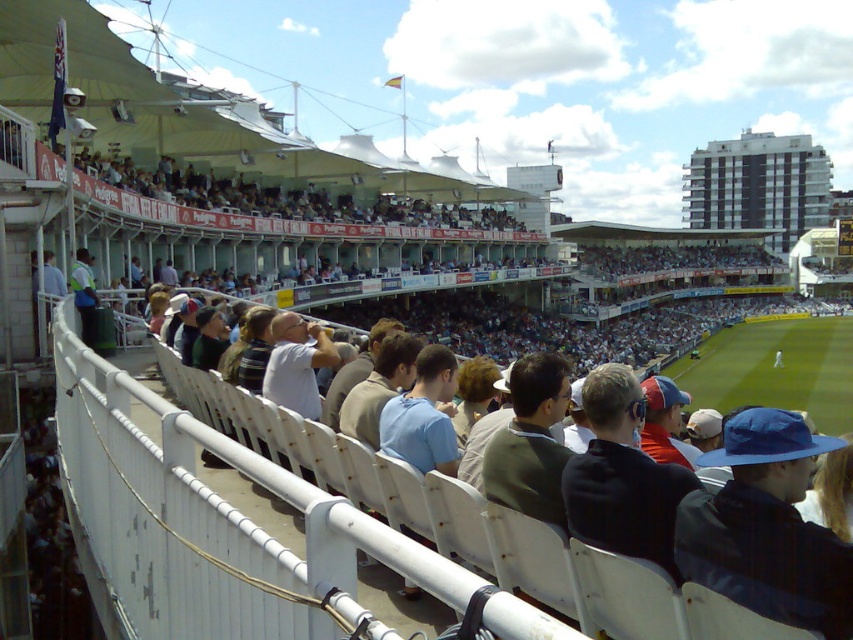
Question: Can you confirm if dark blue cap at center is positioned above green grass at center?

Choices:
 (A) yes
 (B) no

Answer: (B)

Question: Among these points, which one is nearest to the camera?

Choices:
 (A) (167, 182)
 (B) (664, 490)
 (C) (549, 472)

Answer: (B)

Question: Does light brown wooden bench at upper center have a smaller size compared to light brown leather jacket at center?

Choices:
 (A) no
 (B) yes

Answer: (A)

Question: Which of these objects is positioned farthest from the green grass at center?

Choices:
 (A) dark blue cap at center
 (B) light brown leather jacket at center
 (C) light brown wooden bench at upper center

Answer: (B)

Question: Does light brown wooden bench at upper center have a lesser width compared to light brown leather jacket at center?

Choices:
 (A) no
 (B) yes

Answer: (A)

Question: Which object is positioned closest to the light brown leather jacket at center?

Choices:
 (A) light brown wooden bench at upper center
 (B) green grass at center
 (C) dark blue cap at center

Answer: (C)